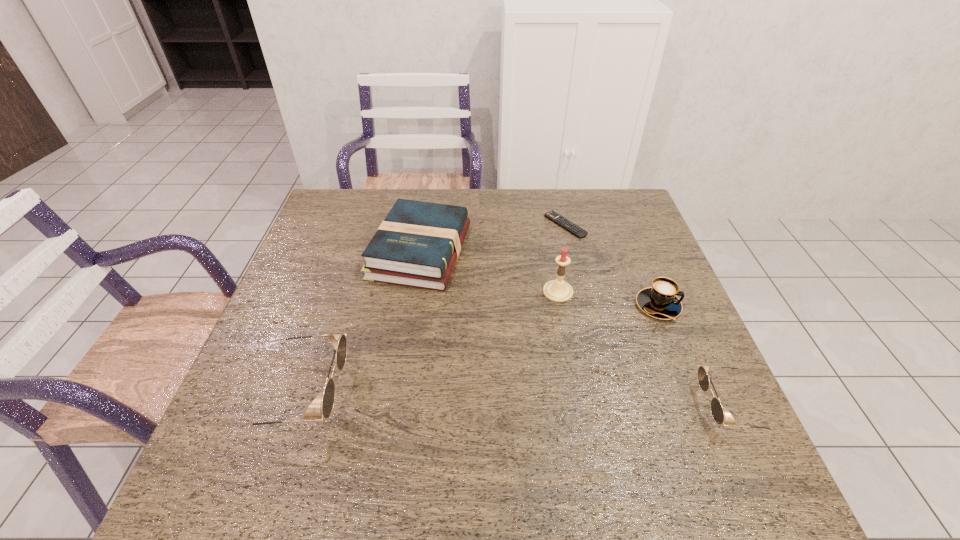
Find the location of a particular element. This screenshot has height=540, width=960. vacant space located 0.340m on the front lenses of the shorter sunglasses is located at coordinates (540, 406).

You are a GUI agent. You are given a task and a screenshot of the screen. Output one action in this format:
    pyautogui.click(x=<x>, y=<y>)
    Task: Click on the vacant space positioned on the front of the tallest object
    This screenshot has width=960, height=540.
    Given the screenshot: What is the action you would take?
    pyautogui.click(x=569, y=353)

The height and width of the screenshot is (540, 960). What are the coordinates of `free spot located 0.080m on the left of the hardback book` in the screenshot? It's located at (344, 252).

Identify the location of vacant space situated 0.260m on the front of the cappuccino. The width and height of the screenshot is (960, 540). (705, 420).

You are a GUI agent. You are given a task and a screenshot of the screen. Output one action in this format:
    pyautogui.click(x=<x>, y=<y>)
    Task: Click on the vacant space located 0.120m on the back of the shortest object
    The height and width of the screenshot is (540, 960).
    Given the screenshot: What is the action you would take?
    pyautogui.click(x=558, y=192)

Identify the location of hardback book located in the far edge section of the desktop. (418, 243).

In order to click on remote control situated at the far edge in this screenshot , I will do [564, 223].

The image size is (960, 540). Identify the location of object located at the left edge. (339, 341).

The image size is (960, 540). In order to click on sunglasses at the right edge in this screenshot , I will do `click(716, 408)`.

Where is `cappuccino situated at the right edge`? This screenshot has height=540, width=960. cappuccino situated at the right edge is located at coordinates (660, 301).